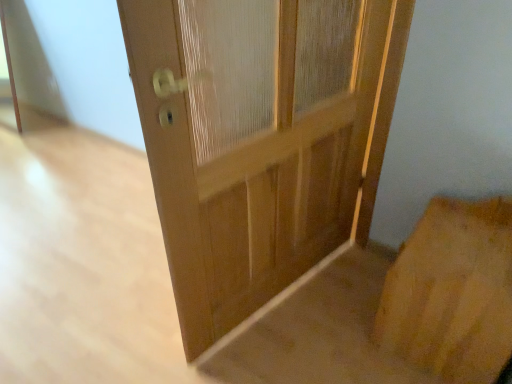
Question: Which is correct: natural wood door at center is inside brown cardboard at lower right, or outside of it?

Choices:
 (A) outside
 (B) inside

Answer: (A)

Question: Is point (222, 332) closer or farther from the camera than point (376, 340)?

Choices:
 (A) farther
 (B) closer

Answer: (A)

Question: In terms of height, does natural wood door at center look taller or shorter compared to brown cardboard at lower right?

Choices:
 (A) short
 (B) tall

Answer: (B)

Question: Is brown cardboard at lower right in front of or behind natural wood door at center in the image?

Choices:
 (A) behind
 (B) front

Answer: (A)

Question: Considering the positions of point (421, 268) and point (291, 137), is point (421, 268) closer or farther from the camera than point (291, 137)?

Choices:
 (A) farther
 (B) closer

Answer: (B)

Question: Looking at their shapes, would you say brown cardboard at lower right is wider or thinner than natural wood door at center?

Choices:
 (A) wide
 (B) thin

Answer: (A)

Question: In terms of height, does brown cardboard at lower right look taller or shorter compared to natural wood door at center?

Choices:
 (A) short
 (B) tall

Answer: (A)